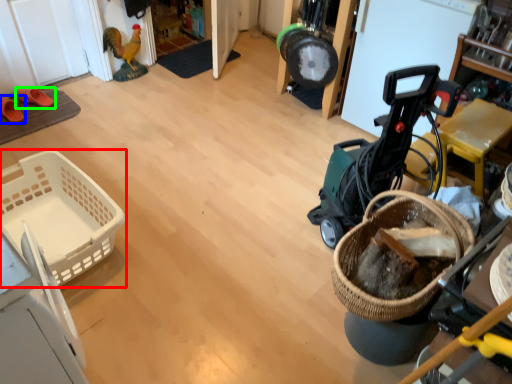
Question: Considering the real-world distances, which object is farthest from basket (highlighted by a red box)? footwear (highlighted by a blue box) or footwear (highlighted by a green box)?

Choices:
 (A) footwear
 (B) footwear

Answer: (B)